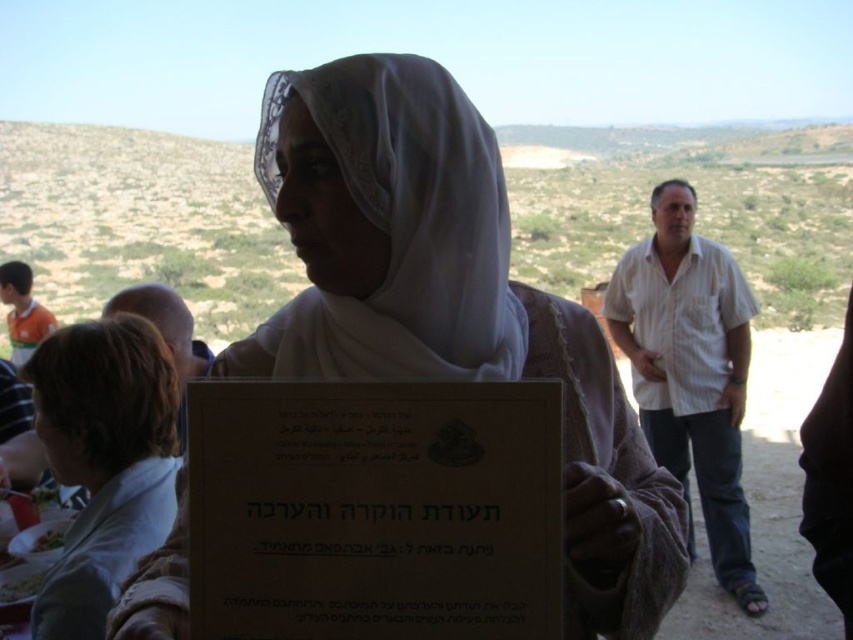
What object is located at the coordinates point (402, 228) in the image?

The point (402, 228) is on the white sheer veil at center.

In the scene shown: You are standing 31.86 inches away from the point at coordinates point (434,436). Can you reach that point with your outstretched hand?

The distance between you and the point (434,436) is 31.86 inches, which is approximately 2.65 feet. Since the average human arm length is about 2.5 feet, you might not be able to reach it with your outstretched hand unless you stretch further or move closer.